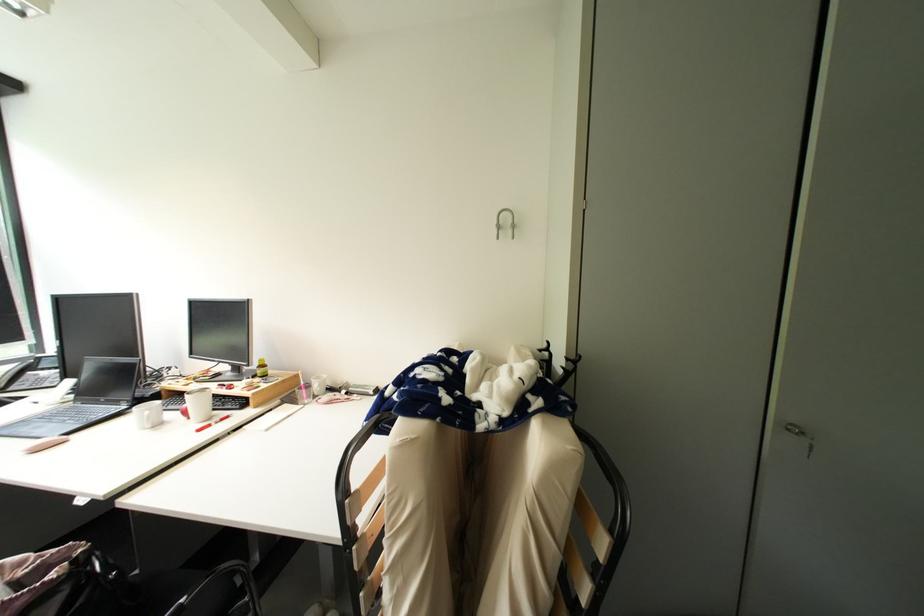
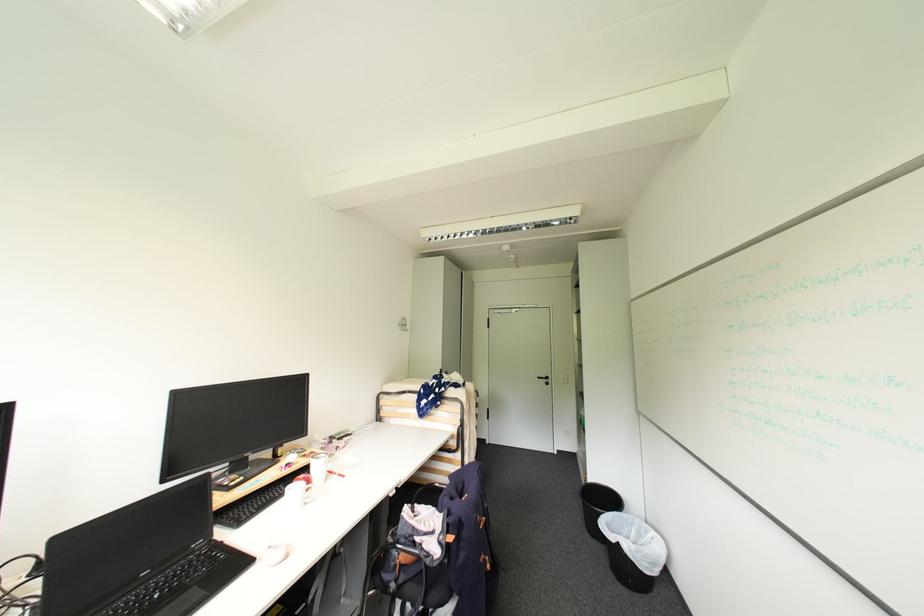
In the second image, find the point that corresponds to [86,553] in the first image.

(417, 506)